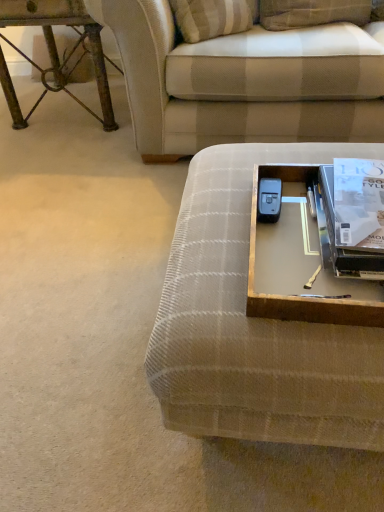
Image resolution: width=384 pixels, height=512 pixels. I want to click on free location to the left of metallic silver tray at lower right, so click(211, 254).